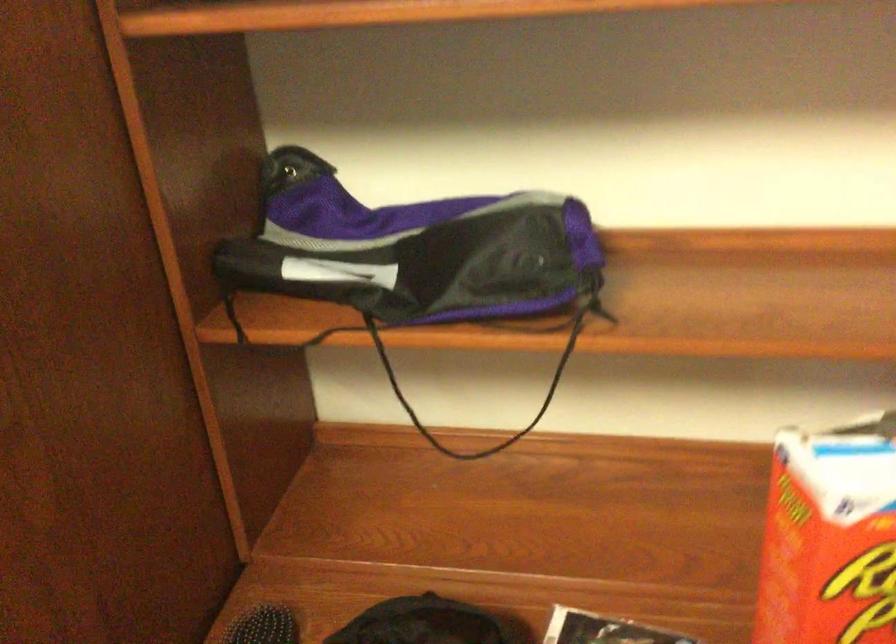
Locate an element on the screen. The height and width of the screenshot is (644, 896). purple and black bag is located at coordinates (415, 259).